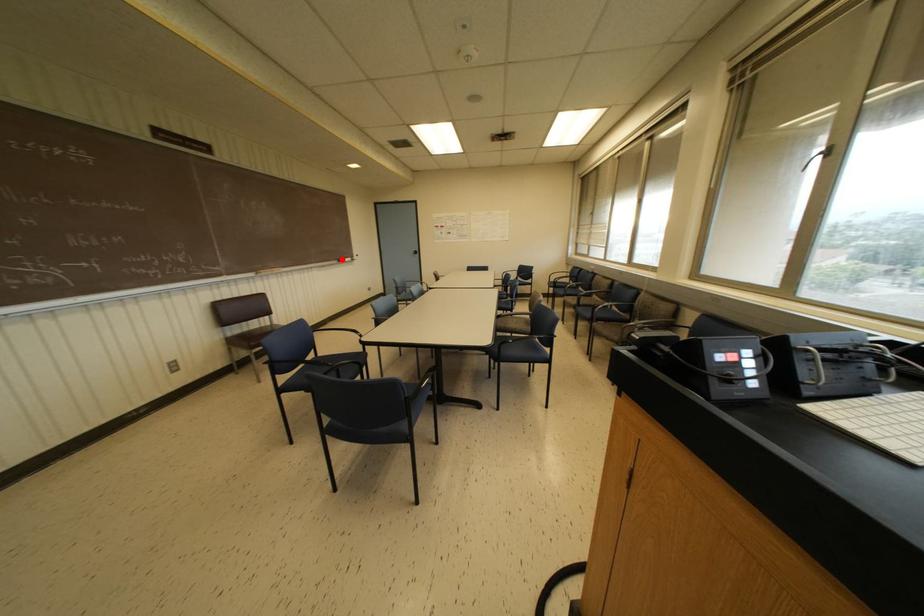
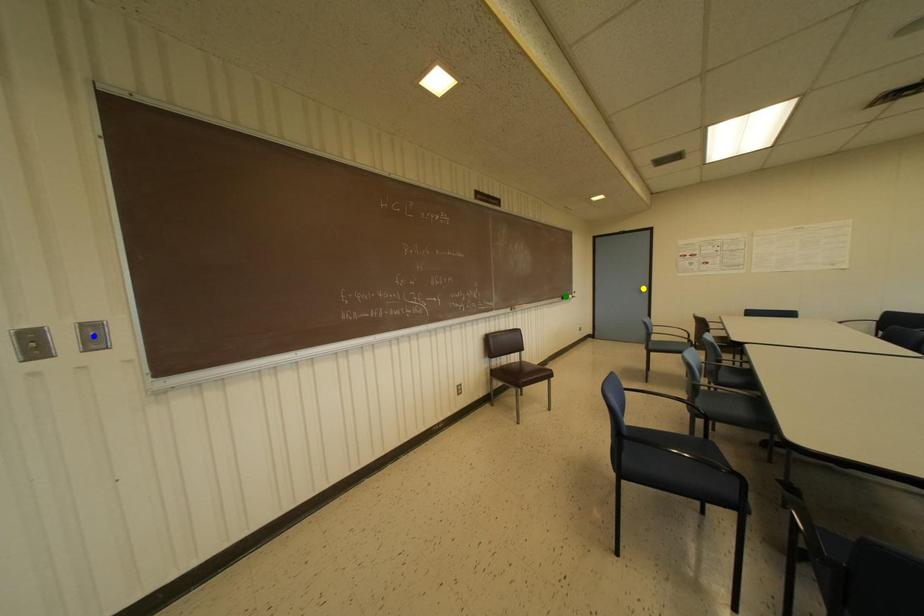
Question: I am providing you with two images of the same scene from different viewpoints. A red point is marked on the first image. You are given multiple points on the second image. Can you choose the point in image 2 that corresponds to the point in image 1?

Choices:
 (A) yellow point
 (B) blue point
 (C) green point

Answer: (C)